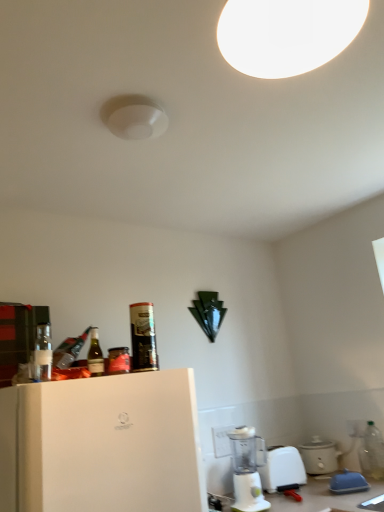
Question: Visually, is matte white slow cooker at lower right, the 1th appliance in the back-to-front sequence, positioned to the left or to the right of white plastic blender at lower center?

Choices:
 (A) left
 (B) right

Answer: (B)

Question: Is matte white slow cooker at lower right, which appears as the 2th appliance when viewed from the front, spatially inside white plastic blender at lower center, or outside of it?

Choices:
 (A) inside
 (B) outside

Answer: (B)

Question: Based on their relative distances, which object is farther from the white plastic blender at lower center?

Choices:
 (A) green glass bottle at left, the third bottle ordered from the bottom
 (B) clear plastic bottle at lower right, which is the first bottle in right-to-left order
 (C) white plastic electric outlet at lower center
 (D) clear glass bottle at left, the 2th bottle in the bottom-to-top sequence
 (E) metallic can at upper left, marked as the 4th bottle in a bottom-to-top arrangement

Answer: (D)

Question: Which of these objects is positioned farthest from the white plastic electric outlet at lower center?

Choices:
 (A) metallic can at upper left, positioned as the 1th bottle in top-to-bottom order
 (B) shiny metallic can at upper left
 (C) matte white slow cooker at lower right, the 1th appliance in the back-to-front sequence
 (D) green glass bottle at left, acting as the 3th bottle starting from the back
 (E) white plastic blender at lower center

Answer: (A)